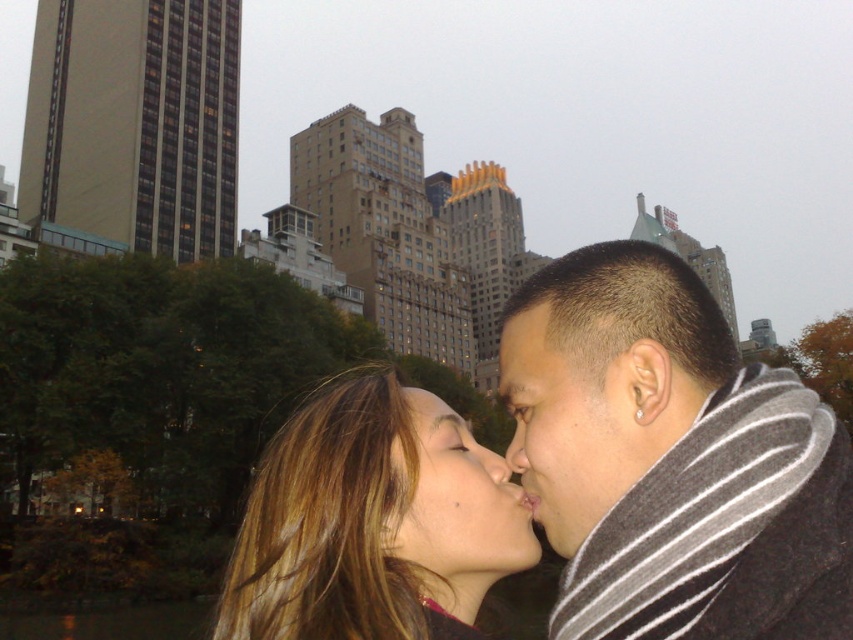
Question: Where is matte skin face at center located in relation to smooth skin nose at center in the image?

Choices:
 (A) below
 (B) above

Answer: (B)

Question: Is blonde hair at center wider than matte skin face at center?

Choices:
 (A) yes
 (B) no

Answer: (A)

Question: Is blonde hair at center further to camera compared to matte skin face at center?

Choices:
 (A) yes
 (B) no

Answer: (B)

Question: Which object is the farthest from the matte black forehead at center?

Choices:
 (A) matte gray scarf at right
 (B) matte skin face at center
 (C) dark gray striped scarf at right
 (D) smooth skin nose at center

Answer: (D)

Question: Which is nearer to the matte skin face at center?

Choices:
 (A) matte black forehead at center
 (B) blonde hair at center
 (C) matte gray scarf at right
 (D) smooth skin nose at center

Answer: (C)

Question: Estimate the real-world distances between objects in this image. Which object is closer to the smooth skin nose at center?

Choices:
 (A) blonde hair at center
 (B) matte skin face at center

Answer: (B)